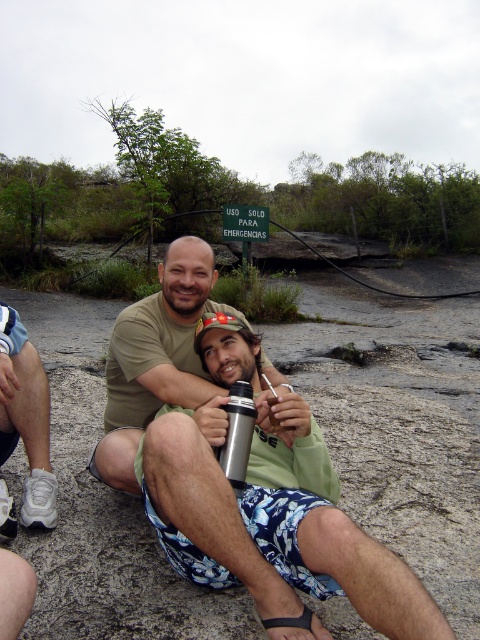
Based on the photo, which is more to the left, matte green t-shirt at center or silver metallic thermos at center?

Positioned to the left is matte green t-shirt at center.

Can you confirm if matte green t-shirt at center is taller than silver metallic thermos at center?

Yes, matte green t-shirt at center is taller than silver metallic thermos at center.

Which is in front, point (197, 269) or point (240, 449)?

Point (240, 449) is more forward.

Image resolution: width=480 pixels, height=640 pixels. I want to click on matte green t-shirt at center, so click(156, 358).

Who is more forward, (295,422) or (21,364)?

Point (295,422) is more forward.

What do you see at coordinates (274, 525) in the screenshot?
I see `metallic silver thermos at center` at bounding box center [274, 525].

Locate an element on the screen. The image size is (480, 640). metallic silver thermos at center is located at coordinates (274, 525).

Which is more to the left, metallic silver thermos at center or matte green t-shirt at center?

matte green t-shirt at center is more to the left.

Can you confirm if metallic silver thermos at center is smaller than matte green t-shirt at center?

Correct, metallic silver thermos at center occupies less space than matte green t-shirt at center.

You are a GUI agent. You are given a task and a screenshot of the screen. Output one action in this format:
    pyautogui.click(x=<x>, y=<y>)
    Task: Click on the metallic silver thermos at center
    
    Given the screenshot: What is the action you would take?
    pyautogui.click(x=274, y=525)

Locate an element on the screen. This screenshot has width=480, height=640. metallic silver thermos at center is located at coordinates (274, 525).